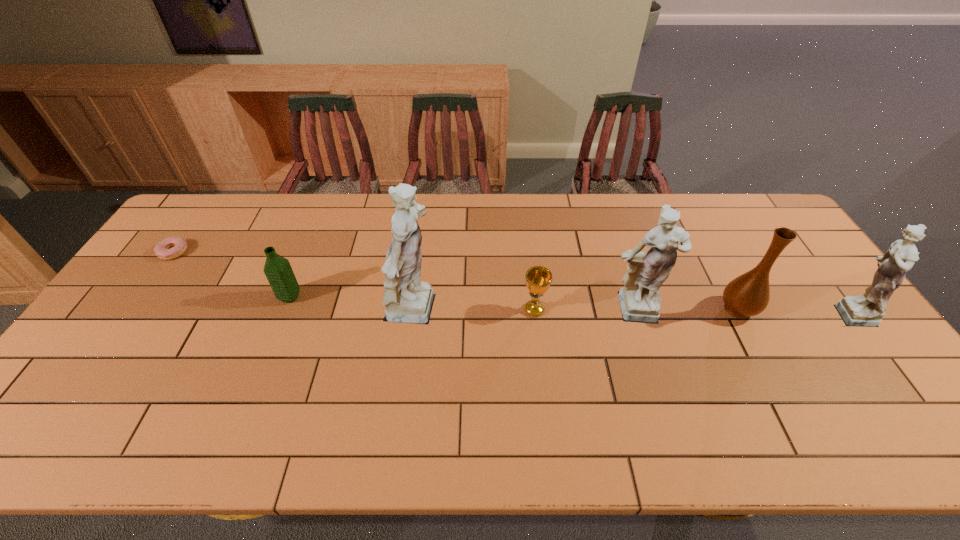
Find the location of a particular element. The height and width of the screenshot is (540, 960). the fifth object from right to left is located at coordinates (408, 300).

You are a GUI agent. You are given a task and a screenshot of the screen. Output one action in this format:
    pyautogui.click(x=<x>, y=<y>)
    Task: Click on the second tallest object
    
    Given the screenshot: What is the action you would take?
    pyautogui.click(x=639, y=299)

The height and width of the screenshot is (540, 960). I want to click on the second figurine from right to left, so click(x=639, y=299).

This screenshot has height=540, width=960. Find the location of `the rightmost figurine`. the rightmost figurine is located at coordinates (867, 310).

This screenshot has width=960, height=540. I want to click on the shortest figurine, so click(867, 310).

Locate an element on the screen. the third shortest object is located at coordinates (278, 271).

What are the coordinates of `water bottle` in the screenshot? It's located at (278, 271).

In order to click on the shortest object in this screenshot , I will do `click(178, 246)`.

Where is `the leftmost object`? The width and height of the screenshot is (960, 540). the leftmost object is located at coordinates (178, 246).

The width and height of the screenshot is (960, 540). What are the coordinates of `vase` in the screenshot? It's located at tap(748, 295).